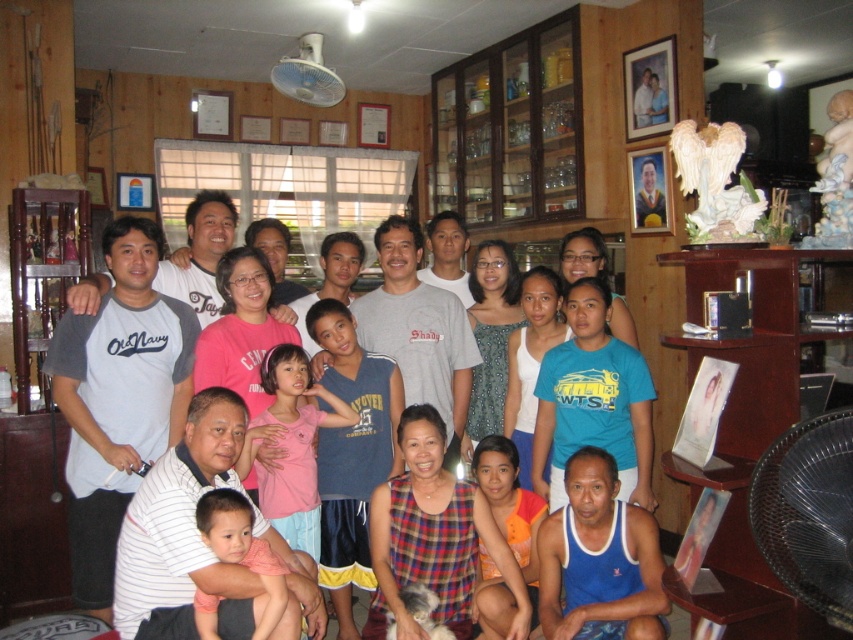
Question: Based on their relative distances, which object is nearer to the pink cotton shirt at center?

Choices:
 (A) orange printed shirt at lower center
 (B) gray cotton t-shirt at left

Answer: (B)

Question: Which object is positioned farthest from the pink cotton shirt at center?

Choices:
 (A) white striped shirt at lower left
 (B) gray cotton t-shirt at left
 (C) striped cotton shirt at center

Answer: (B)

Question: In this image, where is orange printed shirt at lower center located relative to matte pink shirt at center?

Choices:
 (A) right
 (B) left

Answer: (A)

Question: Can you confirm if gray cotton t-shirt at left is positioned to the right of pink cotton shirt at center?

Choices:
 (A) yes
 (B) no

Answer: (B)

Question: Which object appears closest to the camera in this image?

Choices:
 (A) gray cotton t-shirt at left
 (B) white striped shirt at lower left

Answer: (B)

Question: Can you confirm if striped cotton shirt at center is smaller than gray cotton t-shirt at left?

Choices:
 (A) no
 (B) yes

Answer: (A)